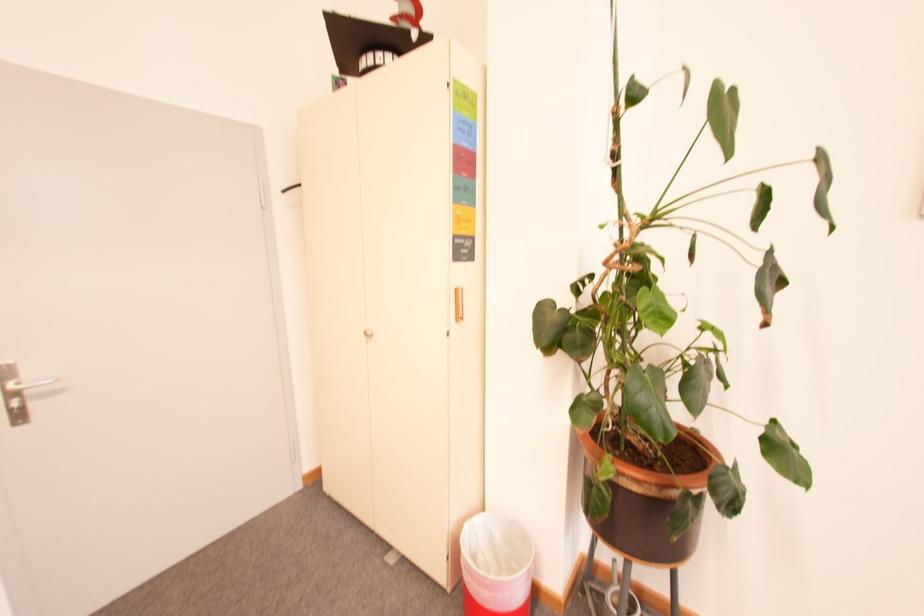
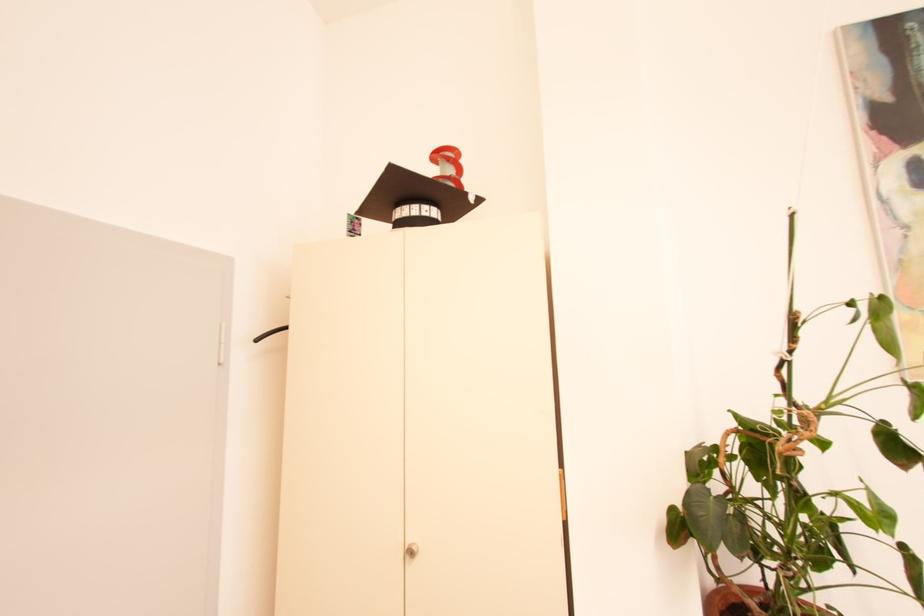
The point at [420,36] is marked in the first image. Where is the corresponding point in the second image?

(478, 199)